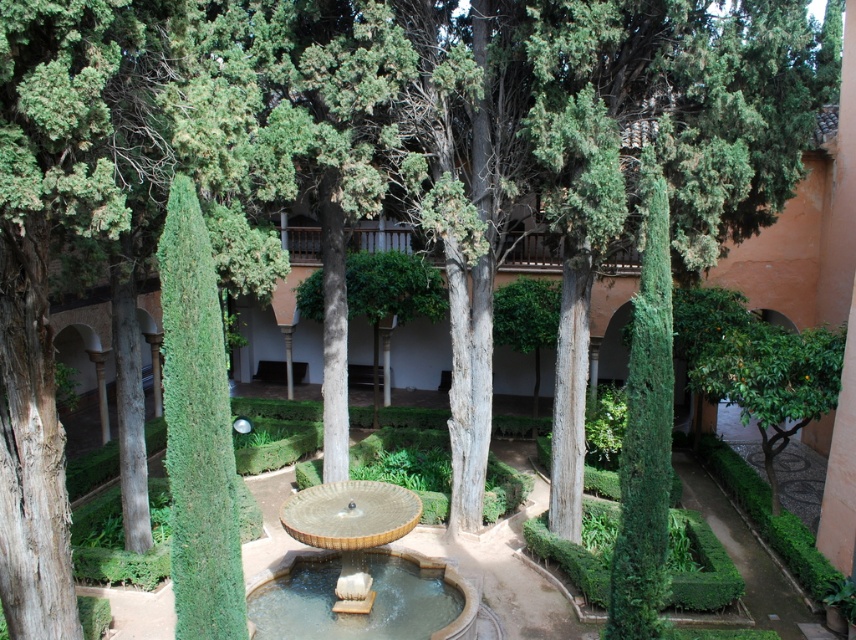
Is gold textured basin at center above green leafy tree at right?

Incorrect, gold textured basin at center is not positioned above green leafy tree at right.

Who is more distant from viewer, (x=351, y=582) or (x=810, y=400)?

The point (x=810, y=400) is behind.

Identify the location of gold textured basin at center. This screenshot has height=640, width=856. [361, 545].

Where is `gold textured basin at center`? This screenshot has width=856, height=640. gold textured basin at center is located at coordinates (361, 545).